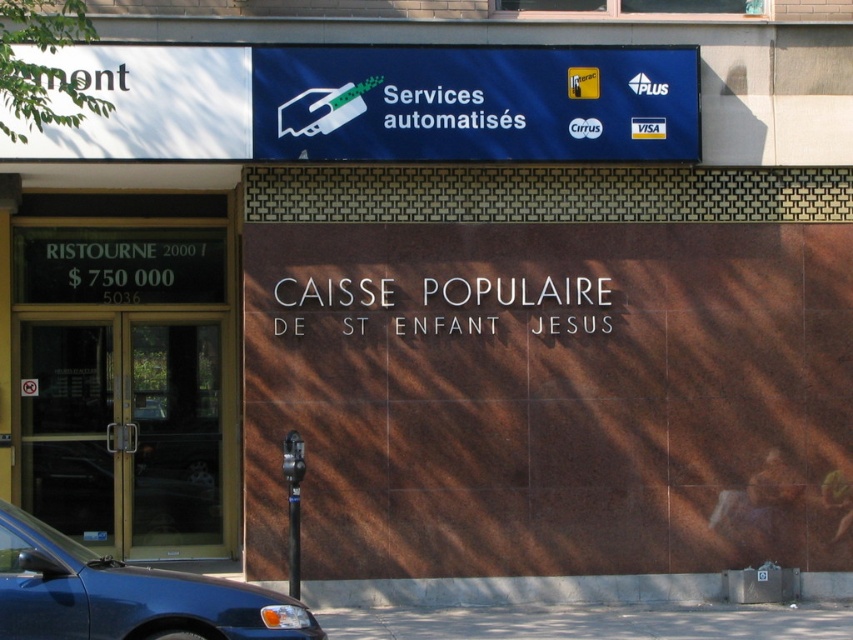
You are a delivery driver who needs to enter the gold metallic door at left to deliver a package. However, your metallic blue car at lower left is parked directly in front of the door. Can you exit your car and walk to the door without moving the car?

The gold metallic door at left is located above the metallic blue car at lower left, which means the car is parked below the door. Since the car is parked below, you can exit the car and walk around it to reach the door without needing to move the vehicle.

Consider the image. You are a delivery driver who needs to enter the gold metallic door at left. Your metallic blue car at lower left is parked next to it. Can you open the door without moving the car?

The gold metallic door at left is taller than the metallic blue car at lower left, so yes, you can open the door without moving the car since the door is taller and there is enough vertical clearance.

You are a delivery person with a large package that requires a door wider than the metallic parking sign at lower center. Can the gold metallic door at left accommodate your package?

The gold metallic door at left is wider than the metallic parking sign at lower center, so yes, the gold metallic door at left can accommodate the package as its width surpasses the parking sign.